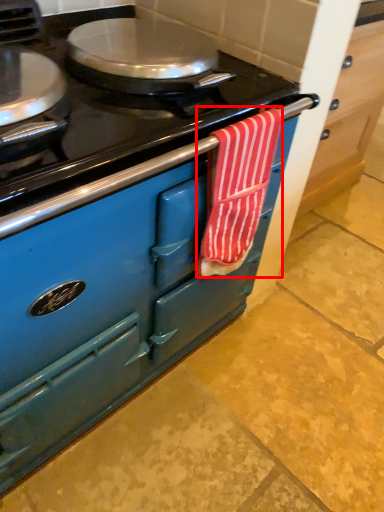
Question: From the image's perspective, what is the correct spatial relationship of beach towel (annotated by the red box) in relation to cabinetry?

Choices:
 (A) below
 (B) above

Answer: (B)